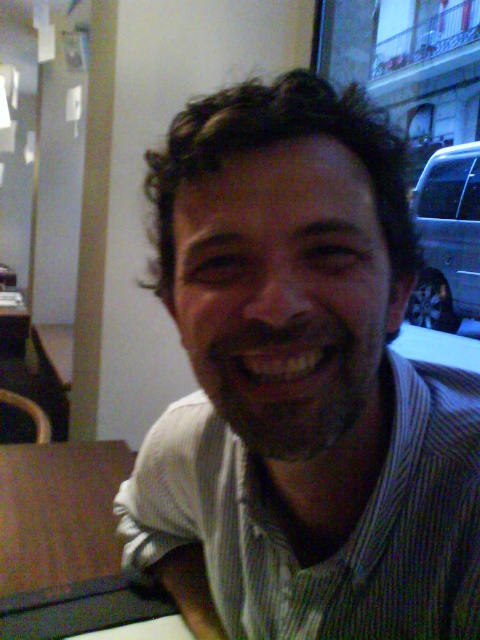
What do you see at coordinates (300, 385) in the screenshot?
I see `green striped shirt at center` at bounding box center [300, 385].

Measure the distance between point (384, 428) and camera.

Point (384, 428) is 18.82 inches away from camera.

This screenshot has height=640, width=480. What are the coordinates of `green striped shirt at center` in the screenshot? It's located at (300, 385).